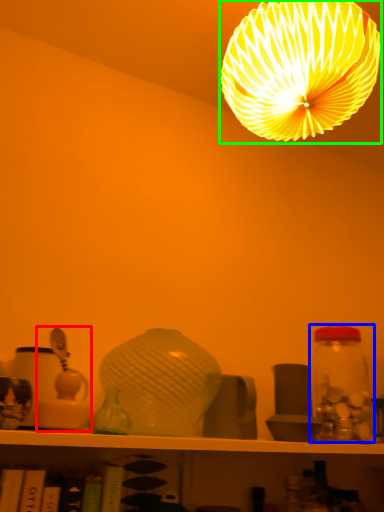
Question: Considering the real-world distances, which object is closest to toy (highlighted by a red box)? glass jar (highlighted by a blue box) or lamp (highlighted by a green box).

Choices:
 (A) glass jar
 (B) lamp

Answer: (A)